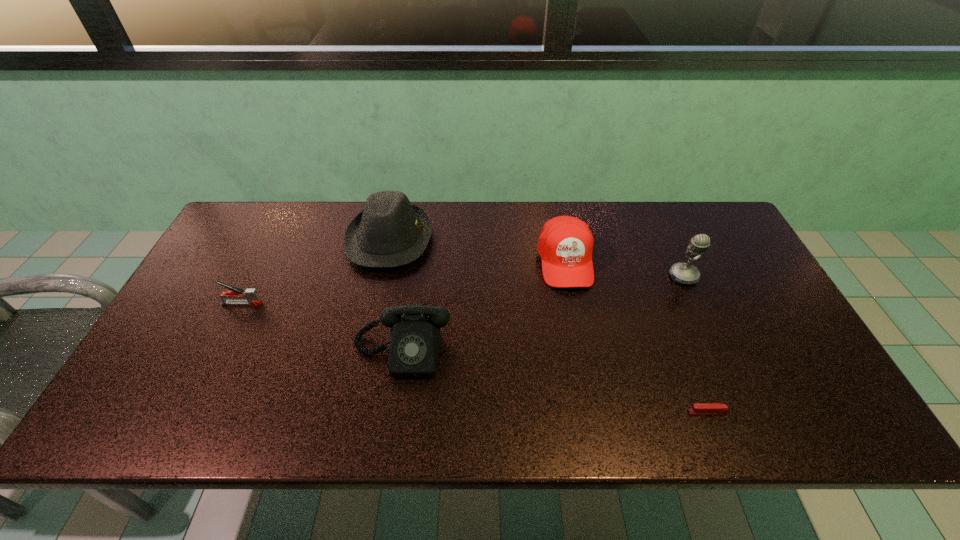
Locate an element on the screen. empty space that is in between the right stapler and the fourth object from left to right is located at coordinates (636, 337).

Locate an element on the screen. The height and width of the screenshot is (540, 960). free space that is in between the baseball cap and the fedora is located at coordinates 477,251.

At what (x,y) coordinates should I click in order to perform the action: click on free space between the tallest object and the baseball cap. Please return your answer as a coordinate pair (x, y). Image resolution: width=960 pixels, height=540 pixels. Looking at the image, I should click on (624, 269).

This screenshot has width=960, height=540. What are the coordinates of `the third closest object to the microphone` in the screenshot? It's located at (414, 344).

Choose which object is the fifth nearest neighbor to the telephone. Please provide its 2D coordinates. Your answer should be formatted as a tuple, i.e. [(x, y)], where the tuple contains the x and y coordinates of a point satisfying the conditions above.

[(683, 273)]

Locate an element on the screen. blank area in the image that satisfies the following two spatial constraints: 1. on the front-facing side of the microphone; 2. on the handle side of the third nearest object is located at coordinates (695, 303).

Image resolution: width=960 pixels, height=540 pixels. What are the coordinates of `vacant space that satisfies the following two spatial constraints: 1. on the front-facing side of the tallest object; 2. on the handle side of the fourth farthest object` in the screenshot? It's located at (695, 303).